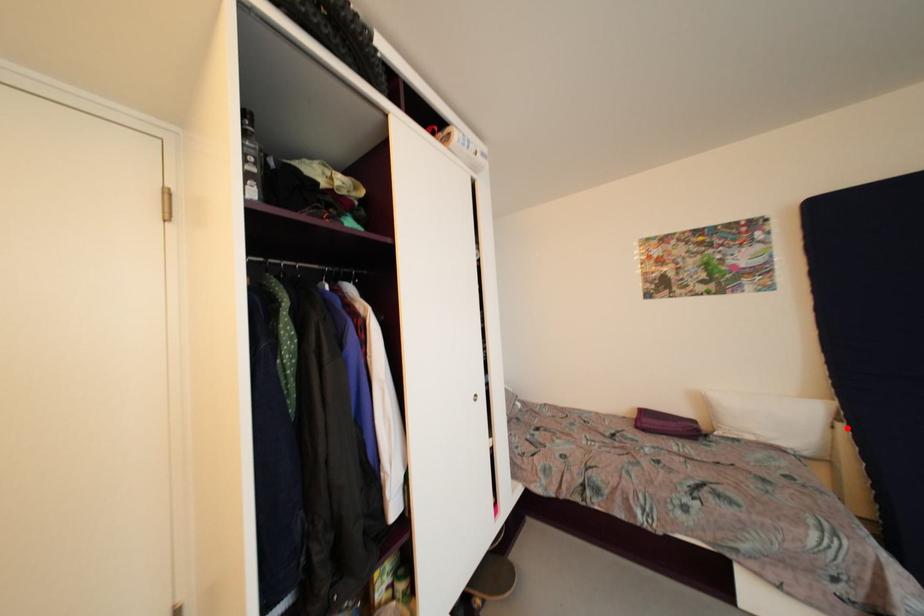
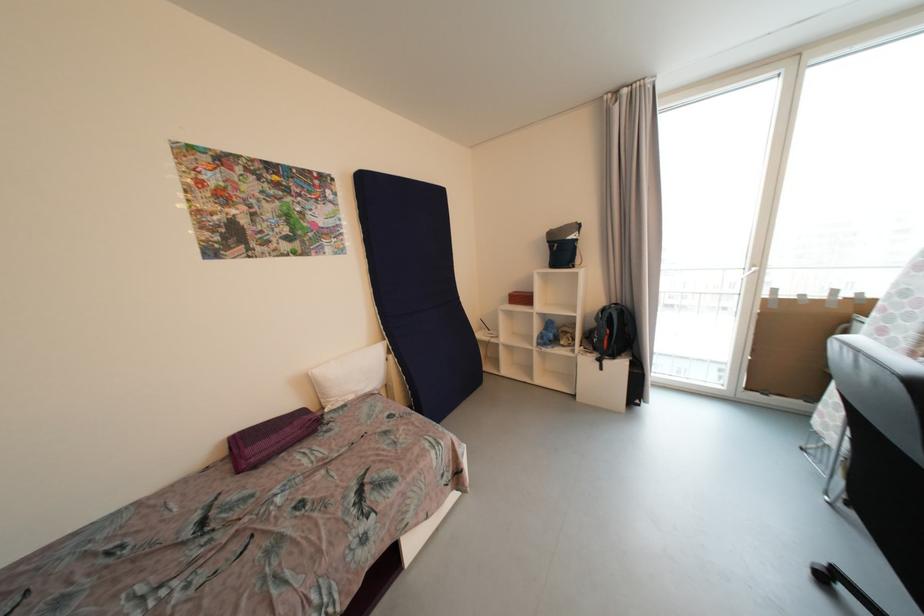
Question: I am providing you with two images of the same scene from different viewpoints. A red point is shown in image1. For the corresponding object point in image2, is it positioned nearer or farther from the camera?

Choices:
 (A) Nearer
 (B) Farther

Answer: (B)